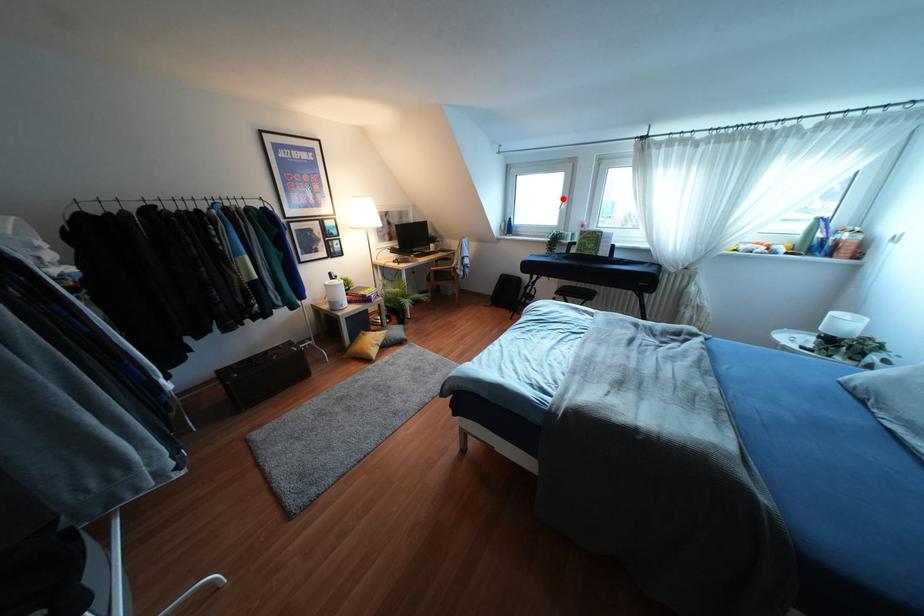
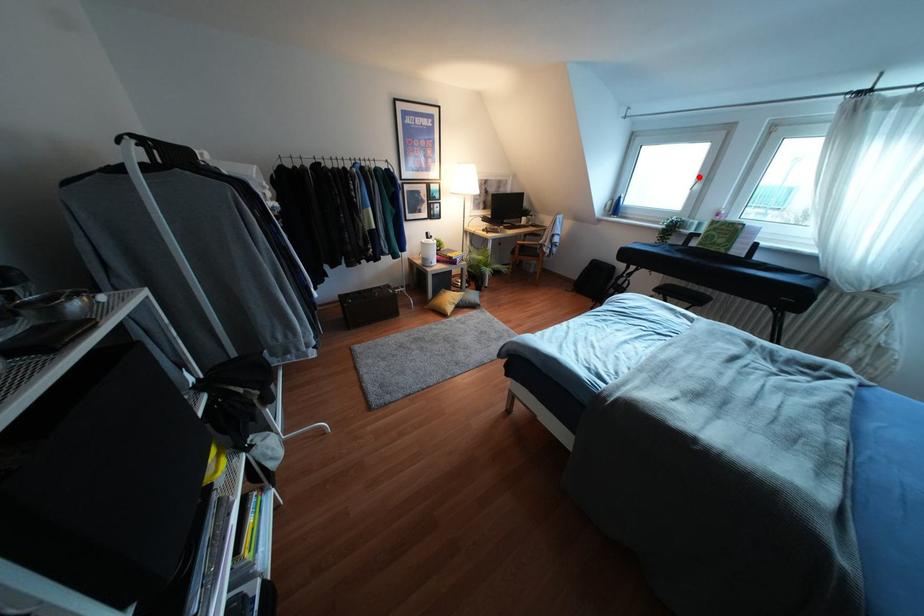
I am providing you with two images of the same scene from different viewpoints. A red point is marked on the first image and another point is marked on the second image. Is the red point in image1 aligned with the point shown in image2?

Yes